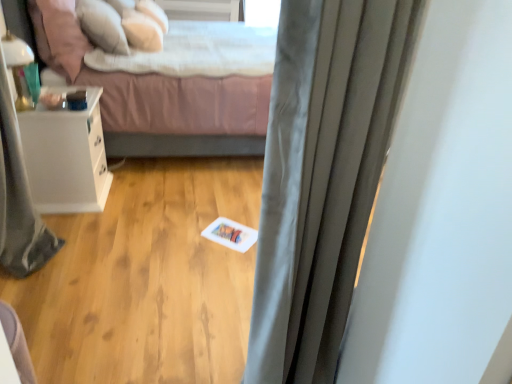
Identify the location of vacant point to the left of white matte card at center. This screenshot has width=512, height=384. (189, 234).